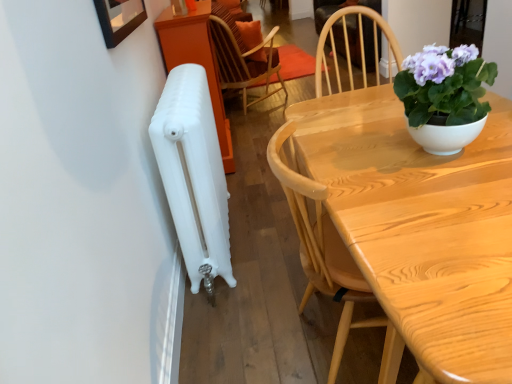
The width and height of the screenshot is (512, 384). What do you see at coordinates (244, 61) in the screenshot?
I see `wooden chair at upper center` at bounding box center [244, 61].

You are a GUI agent. You are given a task and a screenshot of the screen. Output one action in this format:
    pyautogui.click(x=<x>, y=<y>)
    Task: Click on the white matte radiator at left
    Image resolution: width=512 pixels, height=384 pixels.
    Given the screenshot: What is the action you would take?
    pyautogui.click(x=193, y=174)

Describe the element at coordinates (444, 96) in the screenshot. I see `purple glossy plant at upper right` at that location.

This screenshot has width=512, height=384. In order to click on wooden chair at upper center in this screenshot , I will do `click(244, 61)`.

Based on the photo, considering the relative sizes of purple glossy plant at upper right and wooden chair at upper center in the image provided, is purple glossy plant at upper right wider than wooden chair at upper center?

No, purple glossy plant at upper right is not wider than wooden chair at upper center.

How many degrees apart are the facing directions of purple glossy plant at upper right and wooden chair at upper center?

They differ by 45.3 degrees in their facing directions.

Visually, is purple glossy plant at upper right positioned to the left or to the right of wooden chair at upper center?

In the image, purple glossy plant at upper right appears on the right side of wooden chair at upper center.

Where is `table in front of the purple glossy plant at upper right`? table in front of the purple glossy plant at upper right is located at coordinates (421, 228).

Which object is positioned more to the left, light wood table at center or purple glossy plant at upper right?

Positioned to the left is light wood table at center.

From the image's perspective, which is below, light wood table at center or purple glossy plant at upper right?

light wood table at center appears lower in the image.

Based on the photo, which of these two, light wood table at center or wooden chair at upper center, is bigger?

wooden chair at upper center.

Consider the image. Could you tell me if light wood table at center is facing wooden chair at upper center?

No, light wood table at center is not aimed at wooden chair at upper center.

Can you tell me how much light wood table at center and wooden chair at upper center differ in facing direction?

The angular difference between light wood table at center and wooden chair at upper center is 44.7 degrees.

From the image's perspective, which one is positioned higher, light wood table at center or wooden chair at upper center?

wooden chair at upper center is shown above in the image.

Is light wood table at center wider than white matte radiator at left?

Indeed, light wood table at center has a greater width compared to white matte radiator at left.

How many degrees apart are the facing directions of light wood table at center and white matte radiator at left?

The angle between the facing direction of light wood table at center and the facing direction of white matte radiator at left is 1.34 degrees.

Is white matte radiator at left at the back of light wood table at center?

No, light wood table at center's orientation is not away from white matte radiator at left.

Considering the positions of objects light wood table at center and white matte radiator at left in the image provided, who is more to the left, light wood table at center or white matte radiator at left?

white matte radiator at left.

Consider the image. Is purple glossy plant at upper right at the right side of light wood table at center?

Yes.

Are purple glossy plant at upper right and light wood table at center beside each other?

No.

Is purple glossy plant at upper right positioned before light wood table at center?

No, it is not.

Considering the points (417, 115) and (472, 352), which point is in front, point (417, 115) or point (472, 352)?

Positioned in front is point (472, 352).

Locate an element on the screen. table in front of the wooden chair at upper center is located at coordinates (421, 228).

Between point (270, 92) and point (455, 189), which one is positioned behind?

The point (270, 92) is more distant.

Does wooden chair at upper center have a lesser width compared to light wood table at center?

No, wooden chair at upper center is not thinner than light wood table at center.

From the image's perspective, which is below, wooden chair at upper center or purple glossy plant at upper right?

purple glossy plant at upper right.

From a real-world perspective, is wooden chair at upper center beneath purple glossy plant at upper right?

Indeed, from a real-world perspective, wooden chair at upper center is positioned beneath purple glossy plant at upper right.

Can you confirm if wooden chair at upper center is taller than purple glossy plant at upper right?

Yes, wooden chair at upper center is taller than purple glossy plant at upper right.

You are a GUI agent. You are given a task and a screenshot of the screen. Output one action in this format:
    pyautogui.click(x=<x>, y=<y>)
    Task: Click on the houseplant lying on the right of wooden chair at upper center
    This screenshot has height=384, width=512.
    Given the screenshot: What is the action you would take?
    pyautogui.click(x=444, y=96)

This screenshot has width=512, height=384. What are the coordinates of `chair above the purple glossy plant at upper right (from the image's perspective)` in the screenshot? It's located at (244, 61).

The image size is (512, 384). I want to click on table beneath the purple glossy plant at upper right (from a real-world perspective), so click(421, 228).

From the image, which object appears to be farther from white matte radiator at left, light wood table at center or purple glossy plant at upper right?

purple glossy plant at upper right is positioned further to the anchor white matte radiator at left.

From the image, which object appears to be nearer to light wood table at center, wooden chair at upper center or purple glossy plant at upper right?

purple glossy plant at upper right is positioned closer to the anchor light wood table at center.

Estimate the real-world distances between objects in this image. Which object is closer to white matte radiator at left, wooden chair at upper center or light wood table at center?

Based on the image, light wood table at center appears to be nearer to white matte radiator at left.

From the image, which object appears to be nearer to purple glossy plant at upper right, light wood table at center or white matte radiator at left?

light wood table at center is closer to purple glossy plant at upper right.

Based on their spatial positions, is purple glossy plant at upper right or light wood table at center closer to wooden chair at upper center?

The object closer to wooden chair at upper center is light wood table at center.

Considering their positions, is light wood table at center positioned closer to wooden chair at upper center than purple glossy plant at upper right?

Among the two, light wood table at center is located nearer to wooden chair at upper center.

Which object lies nearer to the anchor point purple glossy plant at upper right, white matte radiator at left or wooden chair at upper center?

Among the two, white matte radiator at left is located nearer to purple glossy plant at upper right.

Which object lies nearer to the anchor point wooden chair at upper center, white matte radiator at left or light wood table at center?

white matte radiator at left.

Locate an element on the screen. The width and height of the screenshot is (512, 384). radiator between light wood table at center and wooden chair at upper center from front to back is located at coordinates (193, 174).

Where is `table between white matte radiator at left and purple glossy plant at upper right in the horizontal direction`? table between white matte radiator at left and purple glossy plant at upper right in the horizontal direction is located at coordinates (421, 228).

At what (x,y) coordinates should I click in order to perform the action: click on radiator between purple glossy plant at upper right and wooden chair at upper center along the z-axis. Please return your answer as a coordinate pair (x, y). The width and height of the screenshot is (512, 384). Looking at the image, I should click on tap(193, 174).

You are a GUI agent. You are given a task and a screenshot of the screen. Output one action in this format:
    pyautogui.click(x=<x>, y=<y>)
    Task: Click on the houseplant positioned between light wood table at center and wooden chair at upper center from near to far
    This screenshot has height=384, width=512.
    Given the screenshot: What is the action you would take?
    pyautogui.click(x=444, y=96)